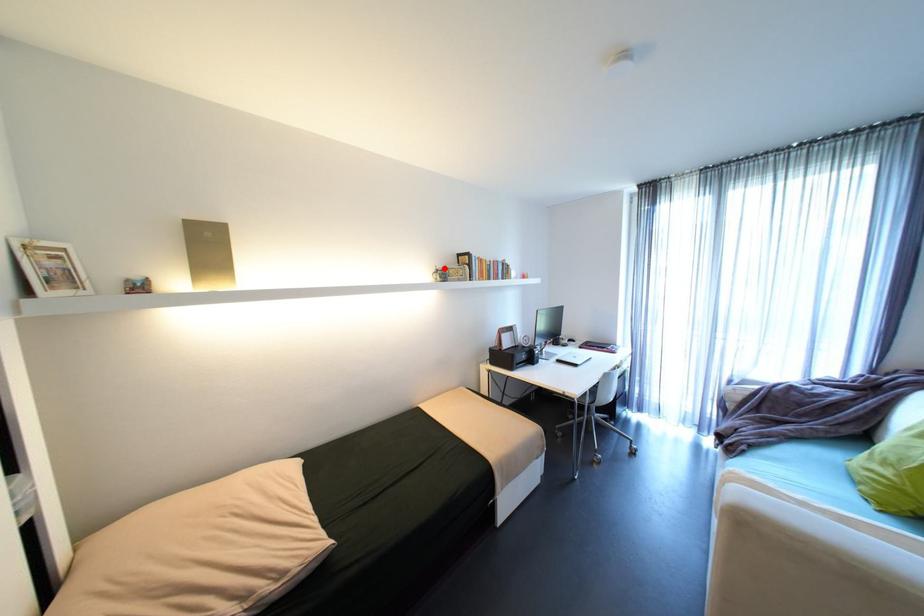
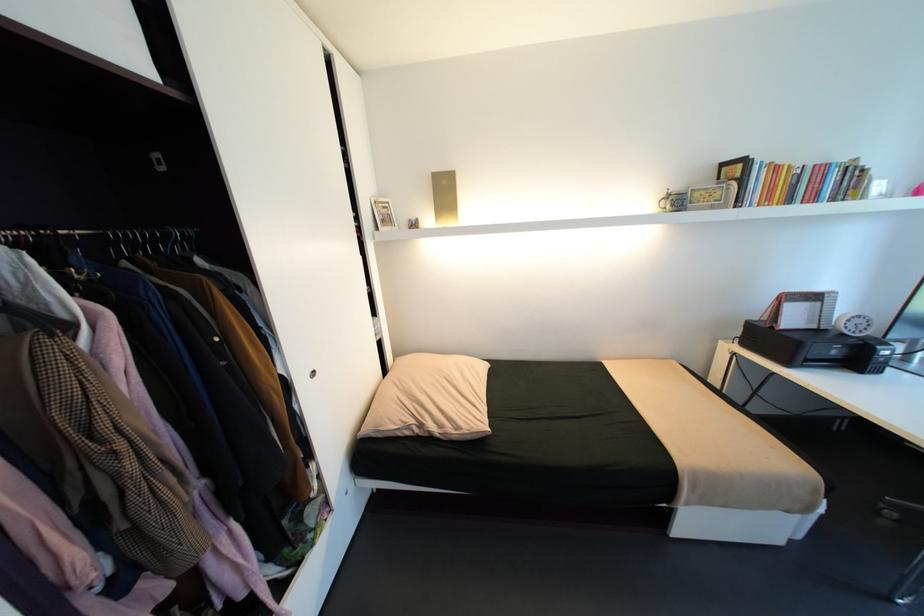
The point at the highlighted location is marked in the first image. Where is the corresponding point in the second image?

(676, 192)